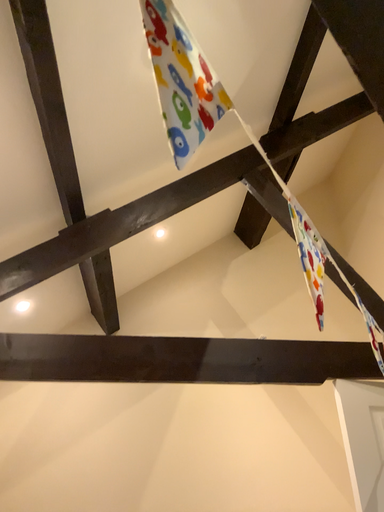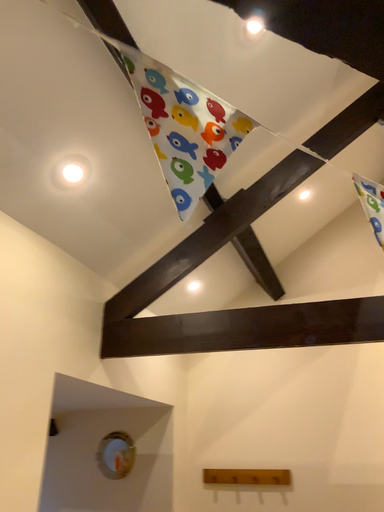
Question: Which way did the camera rotate in the video?

Choices:
 (A) rotated left
 (B) rotated right

Answer: (A)